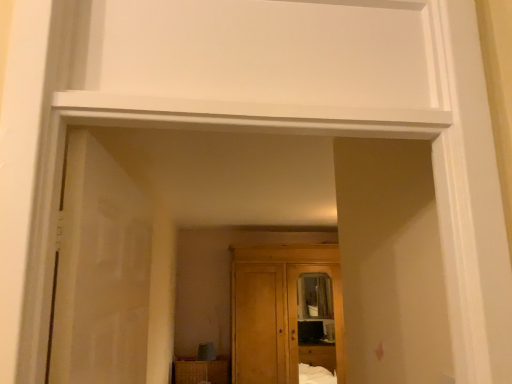
Question: In terms of height, does wooden cabinet at lower center look taller or shorter compared to wooden cupboard at center?

Choices:
 (A) tall
 (B) short

Answer: (B)

Question: Considering the positions of point (224, 370) and point (260, 268), is point (224, 370) closer or farther from the camera than point (260, 268)?

Choices:
 (A) farther
 (B) closer

Answer: (B)

Question: Based on their relative distances, which object is farther from the translucent glass door at left?

Choices:
 (A) wooden cabinet at lower center
 (B) wooden cupboard at center

Answer: (A)

Question: Estimate the real-world distances between objects in this image. Which object is farther from the wooden cupboard at center?

Choices:
 (A) translucent glass door at left
 (B) wooden cabinet at lower center

Answer: (A)